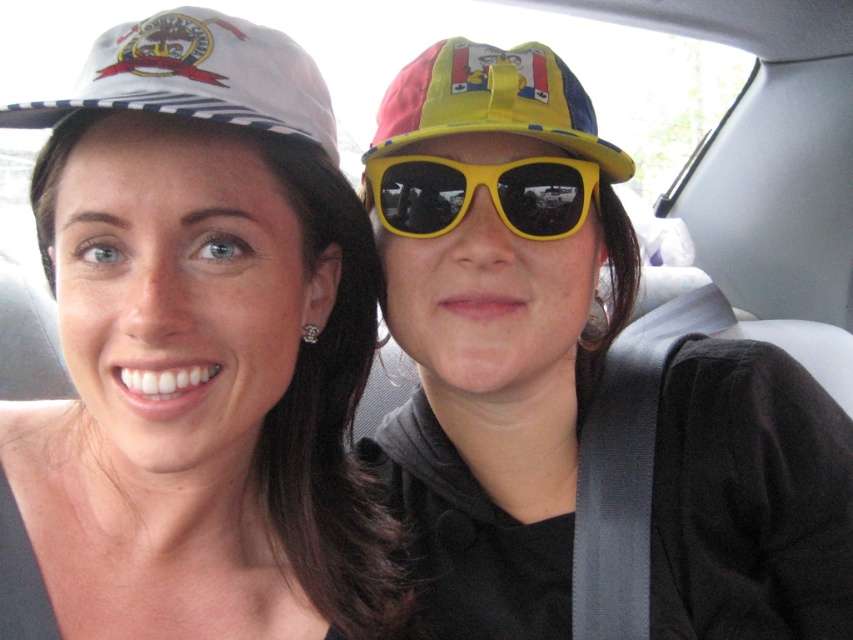
Question: Which point appears closest to the camera in this image?

Choices:
 (A) (24, 124)
 (B) (262, 548)

Answer: (A)

Question: Is yellow matte sunglasses at upper center smaller than yellow plastic sunglasses at center?

Choices:
 (A) yes
 (B) no

Answer: (B)

Question: Which is nearer to the yellow fabric cap at upper center?

Choices:
 (A) yellow plastic sunglasses at center
 (B) yellow matte sunglasses at upper center
 (C) white glossy hat at upper left

Answer: (A)

Question: Does yellow matte sunglasses at upper center have a greater width compared to white printed baseball cap at upper left?

Choices:
 (A) no
 (B) yes

Answer: (B)

Question: Is white glossy hat at upper left thinner than white printed baseball cap at upper left?

Choices:
 (A) yes
 (B) no

Answer: (B)

Question: Which point appears farthest from the camera in this image?

Choices:
 (A) (167, 294)
 (B) (802, 528)

Answer: (B)